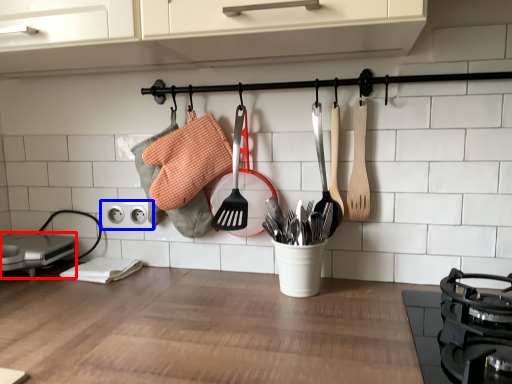
Question: Which object is closer to the camera taking this photo, appliance (highlighted by a red box) or electric outlet (highlighted by a blue box)?

Choices:
 (A) appliance
 (B) electric outlet

Answer: (A)